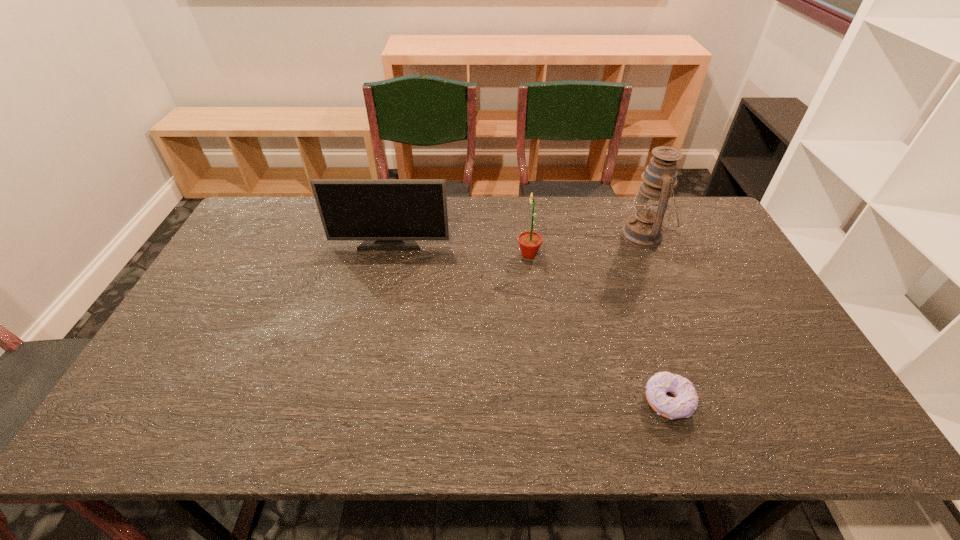
Locate an element on the screen. Image resolution: width=960 pixels, height=540 pixels. oil lamp is located at coordinates (644, 229).

This screenshot has width=960, height=540. What are the coordinates of `the leftmost object` in the screenshot? It's located at (389, 214).

The width and height of the screenshot is (960, 540). I want to click on sunflower, so click(530, 242).

Where is `doughnut`? This screenshot has height=540, width=960. doughnut is located at coordinates (683, 405).

You are a GUI agent. You are given a task and a screenshot of the screen. Output one action in this format:
    pyautogui.click(x=<x>, y=<y>)
    Task: Click on the nearest object
    
    Given the screenshot: What is the action you would take?
    pyautogui.click(x=683, y=405)

This screenshot has height=540, width=960. Find the location of `vacant region located 0.100m on the front of the tallest object`. vacant region located 0.100m on the front of the tallest object is located at coordinates (661, 277).

This screenshot has width=960, height=540. What are the coordinates of `free point located 0.250m on the screen side of the leftmost object` in the screenshot? It's located at (375, 309).

You are a GUI agent. You are given a task and a screenshot of the screen. Output one action in this format:
    pyautogui.click(x=<x>, y=<y>)
    Task: Click on the free region located on the face of the second object from left to right
    
    Given the screenshot: What is the action you would take?
    pyautogui.click(x=421, y=255)

At what (x,y) coordinates should I click in order to perform the action: click on vacant space situated 0.060m on the face of the second object from left to right. Please return your answer as a coordinate pair (x, y). Looking at the image, I should click on (498, 255).

The width and height of the screenshot is (960, 540). I want to click on vacant space located 0.100m on the face of the second object from left to right, so click(x=485, y=255).